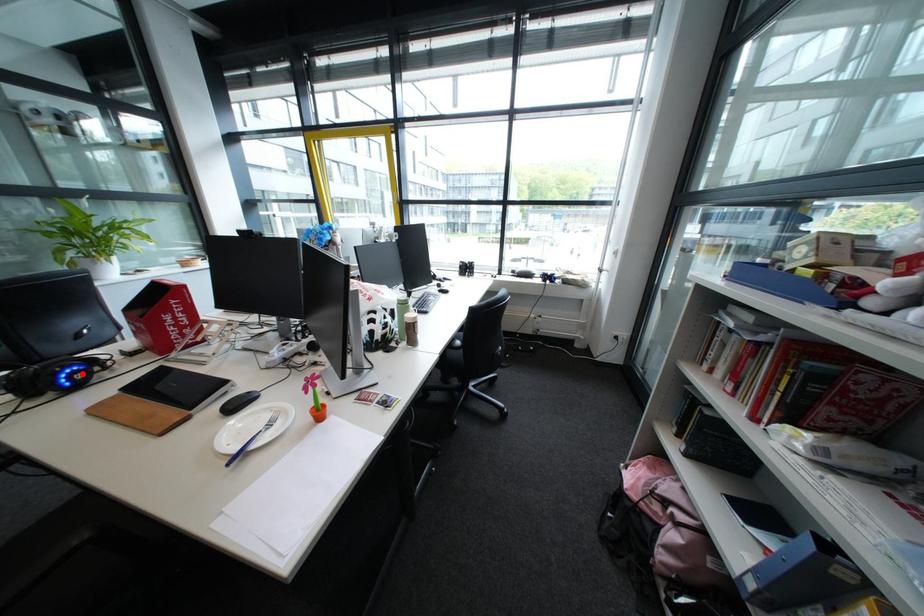
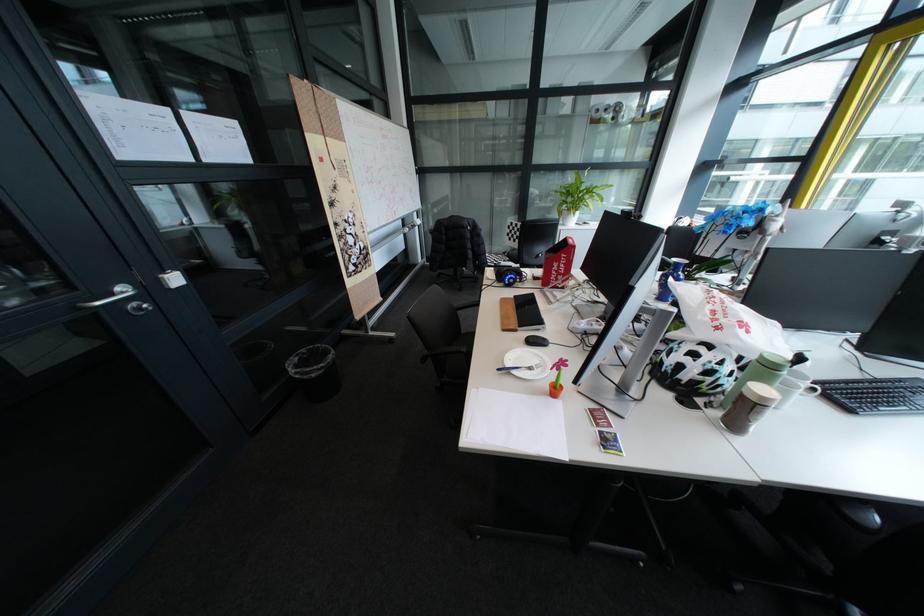
Question: I am providing you with two images of the same scene from different viewpoints. A red point is marked on the first image. At the location where the point appears in image 1, is it still visible in image 2?

Choices:
 (A) Yes
 (B) No

Answer: (A)